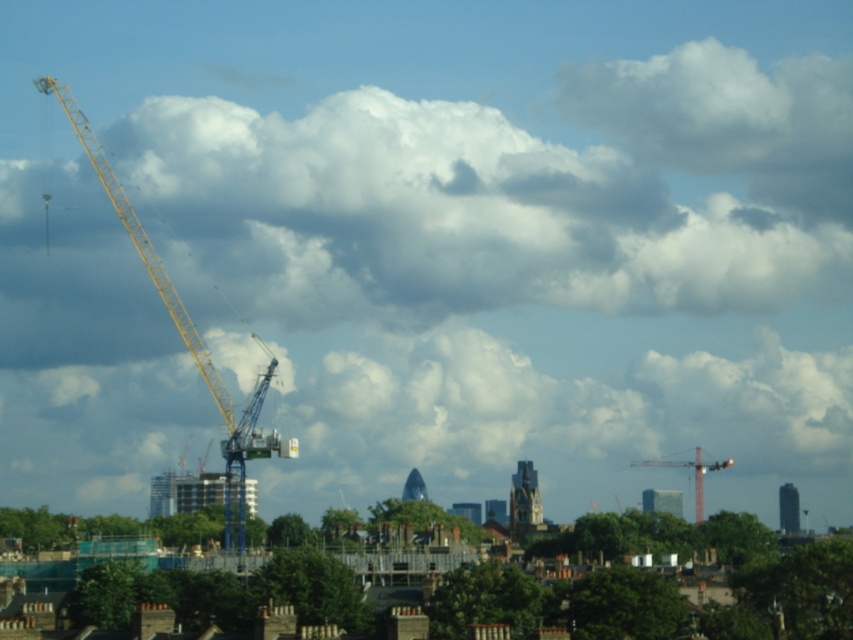
Question: Which object appears closest to the camera in this image?

Choices:
 (A) blue metallic crane at left
 (B) metallic yellow crane at center

Answer: (A)

Question: Is blue metallic crane at left to the right of metallic yellow crane at center from the viewer's perspective?

Choices:
 (A) no
 (B) yes

Answer: (A)

Question: Can you confirm if yellow metallic crane at left is positioned to the left of metallic yellow crane at center?

Choices:
 (A) yes
 (B) no

Answer: (A)

Question: Which point is closer to the camera?

Choices:
 (A) (250, 595)
 (B) (722, 461)
 (C) (273, 358)

Answer: (A)

Question: Does yellow metallic crane at left have a larger size compared to metallic yellow crane at center?

Choices:
 (A) yes
 (B) no

Answer: (A)

Question: Which of the following is the closest to the observer?

Choices:
 (A) (631, 460)
 (B) (834, 621)

Answer: (B)